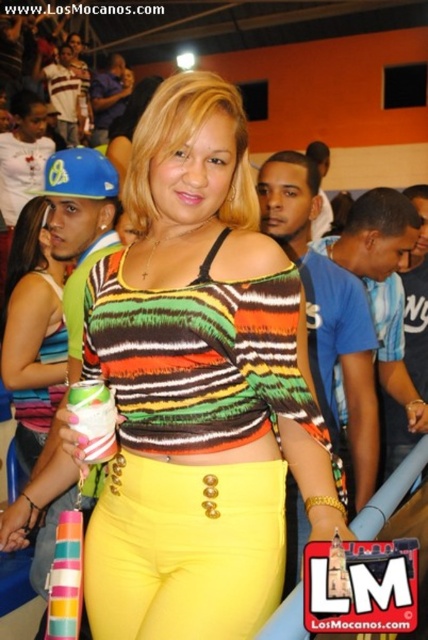
Question: Is matte striped top at center bigger than yellow matte pants at center?

Choices:
 (A) yes
 (B) no

Answer: (A)

Question: Is matte striped top at center smaller than striped fabric top at center?

Choices:
 (A) no
 (B) yes

Answer: (B)

Question: Which object appears farthest from the camera in this image?

Choices:
 (A) yellow matte pants at center
 (B) matte striped top at center
 (C) striped fabric top at center

Answer: (C)

Question: Can you confirm if yellow matte pants at center is positioned to the right of striped fabric top at center?

Choices:
 (A) no
 (B) yes

Answer: (B)

Question: Which point is farther to the camera?

Choices:
 (A) [x=297, y=348]
 (B) [x=107, y=534]
 (C) [x=41, y=323]

Answer: (C)

Question: Among these objects, which one is farthest from the camera?

Choices:
 (A) matte striped top at center
 (B) yellow matte pants at center
 (C) striped fabric top at center

Answer: (C)